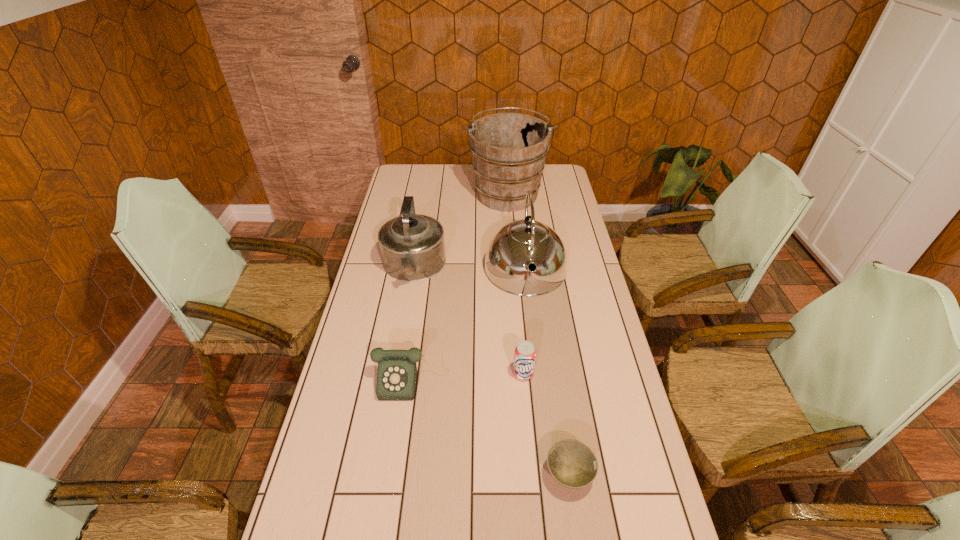
Locate an element on the screen. free point located 0.270m with the spout at the front of the third tallest object is located at coordinates (398, 357).

Image resolution: width=960 pixels, height=540 pixels. What are the coordinates of `free space located on the left of the soda can` in the screenshot? It's located at (461, 374).

At what (x,y) coordinates should I click in order to perform the action: click on vacant space located on the dial of the telephone. Please return your answer as a coordinate pair (x, y). Image resolution: width=960 pixels, height=540 pixels. Looking at the image, I should click on (398, 478).

In order to click on blank area located 0.090m on the back of the bowl in this screenshot , I will do `click(561, 420)`.

The height and width of the screenshot is (540, 960). Identify the location of object that is at the far edge. (509, 150).

Where is `kettle present at the left edge`? kettle present at the left edge is located at coordinates (412, 247).

At what (x,y) coordinates should I click in order to perform the action: click on telephone present at the left edge. Please return your answer as a coordinate pair (x, y). Looking at the image, I should click on (397, 372).

You are a GUI agent. You are given a task and a screenshot of the screen. Output one action in this format:
    pyautogui.click(x=<x>, y=<y>)
    Task: Click on the bucket that is at the right edge
    This screenshot has width=960, height=540.
    Given the screenshot: What is the action you would take?
    pyautogui.click(x=509, y=150)

I want to click on kettle present at the right edge, so click(513, 247).

Find the location of a particular element. This screenshot has width=960, height=540. bowl situated at the right edge is located at coordinates (572, 464).